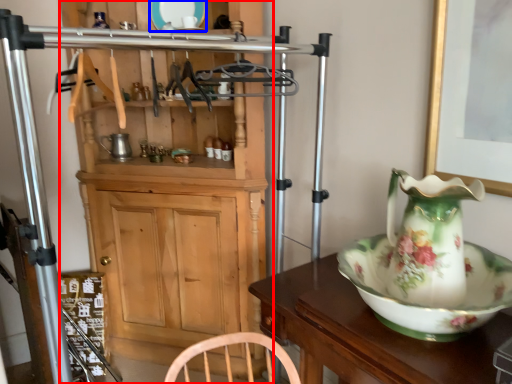
Question: Among these objects, which one is nearest to the camera, cabinetry (highlighted by a red box) or plate (highlighted by a blue box)?

Choices:
 (A) cabinetry
 (B) plate

Answer: (A)